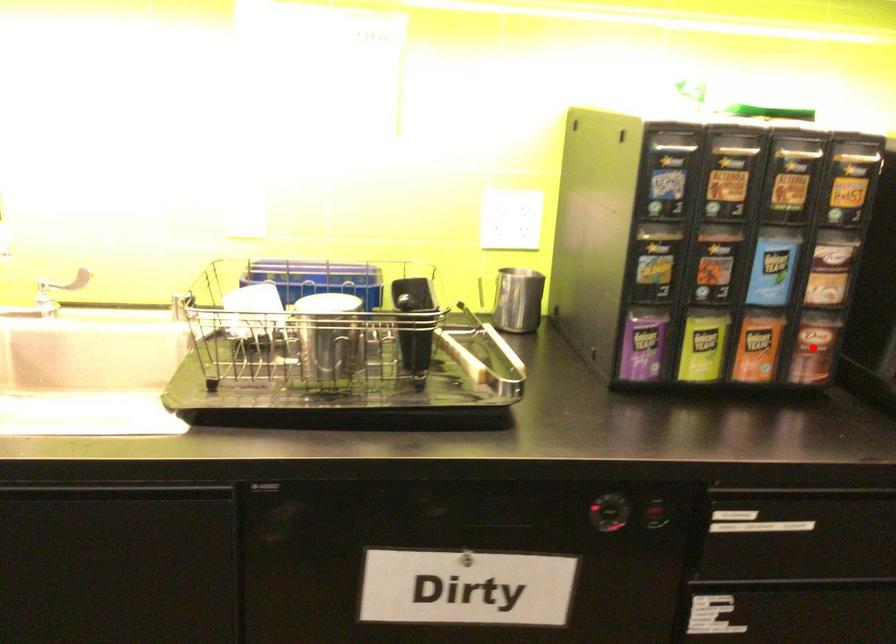
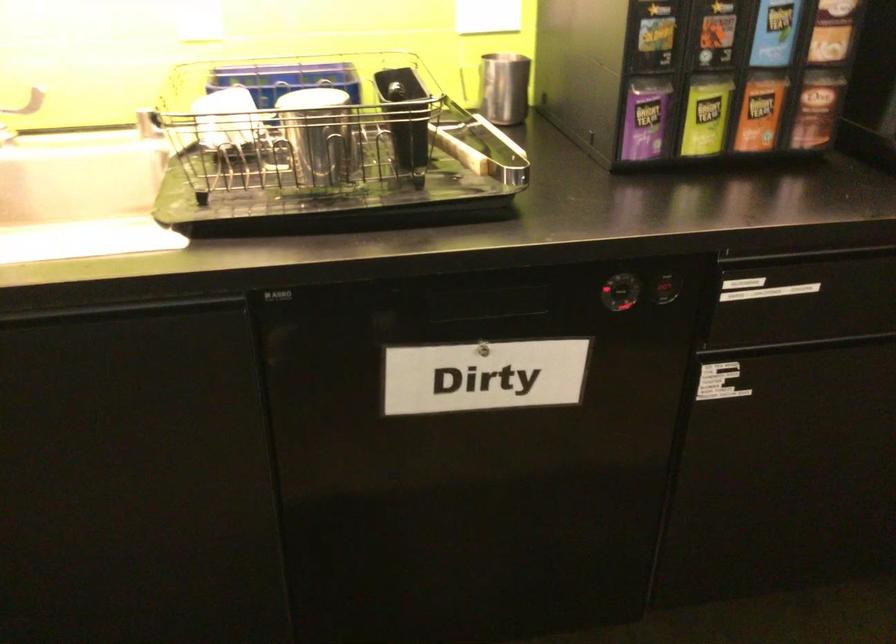
The point at the highlighted location is marked in the first image. Where is the corresponding point in the second image?

(816, 109)